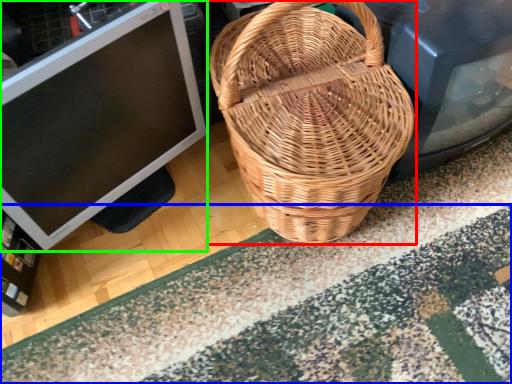
Question: Which object is the farthest from picnic basket (highlighted by a red box)? Choose among these: doormat (highlighted by a blue box) or computer monitor (highlighted by a green box).

Choices:
 (A) doormat
 (B) computer monitor

Answer: (A)